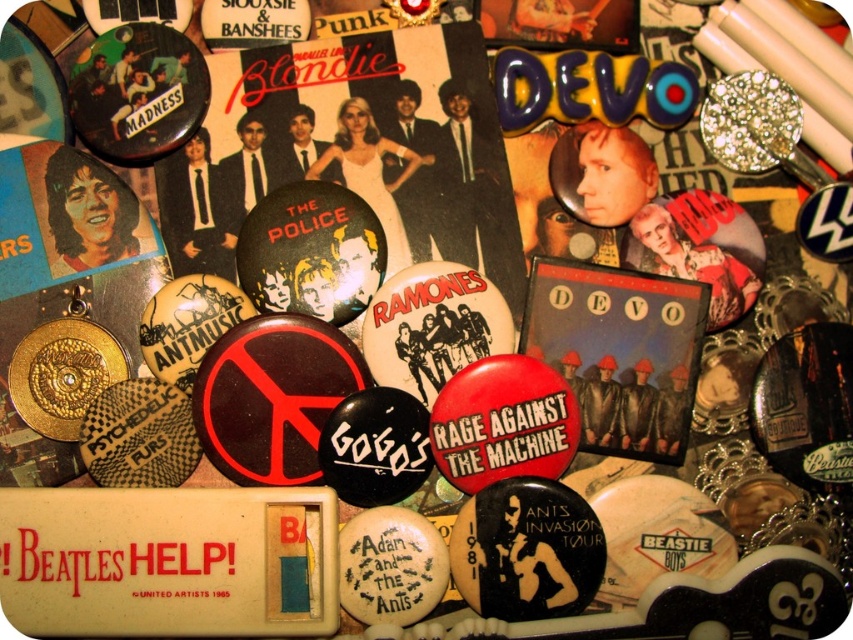
You are looking at the collection of vintage pins and notice two specific points in the display. The first point is located at coordinates point (505, 12) and the second at point (283, 29). From your perspective, which point appears closer to you?

Point (505, 12) is further to the viewer than point (283, 29), so the second point appears closer.